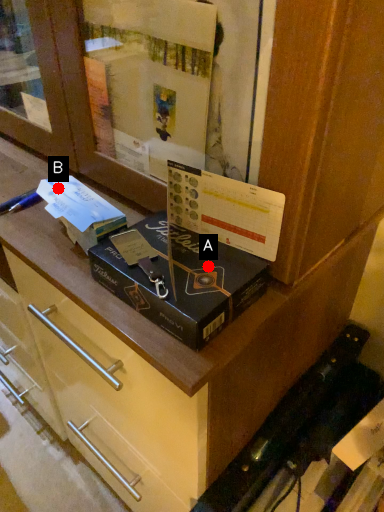
Question: Two points are circled on the image, labeled by A and B beside each circle. Which point is closer to the camera taking this photo?

Choices:
 (A) A is closer
 (B) B is closer

Answer: (A)